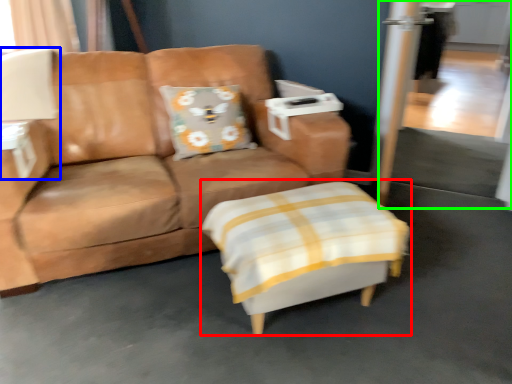
Question: Estimate the real-world distances between objects in this image. Which object is farther from swivel chair (highlighted by a red box), table lamp (highlighted by a blue box) or screen door (highlighted by a green box)?

Choices:
 (A) table lamp
 (B) screen door

Answer: (A)